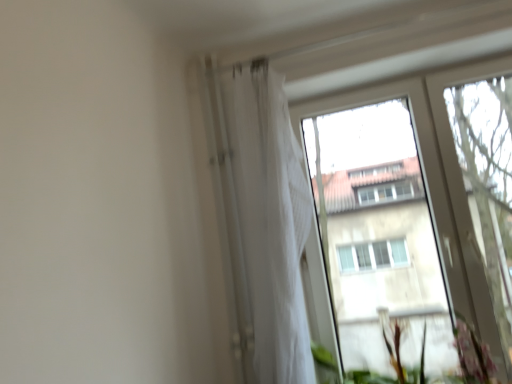
Question: Does transparent glass tree at right lie in front of green leafy plant at lower right?

Choices:
 (A) yes
 (B) no

Answer: (B)

Question: From the image's perspective, is transparent glass tree at right above green leafy plant at lower right?

Choices:
 (A) yes
 (B) no

Answer: (A)

Question: Does transparent glass tree at right have a greater height compared to green leafy plant at lower right?

Choices:
 (A) yes
 (B) no

Answer: (A)

Question: Considering the relative sizes of transparent glass tree at right and green leafy plant at lower right in the image provided, is transparent glass tree at right wider than green leafy plant at lower right?

Choices:
 (A) no
 (B) yes

Answer: (A)

Question: Is there a large distance between transparent glass tree at right and green leafy plant at lower right?

Choices:
 (A) no
 (B) yes

Answer: (A)

Question: Is transparent glass tree at right further to the viewer compared to green leafy plant at lower right?

Choices:
 (A) no
 (B) yes

Answer: (B)

Question: From a real-world perspective, is green leafy plant at lower right positioned over transparent glass tree at right based on gravity?

Choices:
 (A) yes
 (B) no

Answer: (B)

Question: Is green leafy plant at lower right positioned with its back to transparent glass tree at right?

Choices:
 (A) yes
 (B) no

Answer: (B)

Question: Is green leafy plant at lower right far away from transparent glass tree at right?

Choices:
 (A) yes
 (B) no

Answer: (B)

Question: Does green leafy plant at lower right turn towards transparent glass tree at right?

Choices:
 (A) yes
 (B) no

Answer: (B)

Question: Can you confirm if green leafy plant at lower right is smaller than transparent glass tree at right?

Choices:
 (A) yes
 (B) no

Answer: (A)

Question: Does green leafy plant at lower right appear on the right side of transparent glass tree at right?

Choices:
 (A) no
 (B) yes

Answer: (A)

Question: From the image's perspective, is white sheer curtain at upper center below transparent glass tree at right?

Choices:
 (A) yes
 (B) no

Answer: (A)